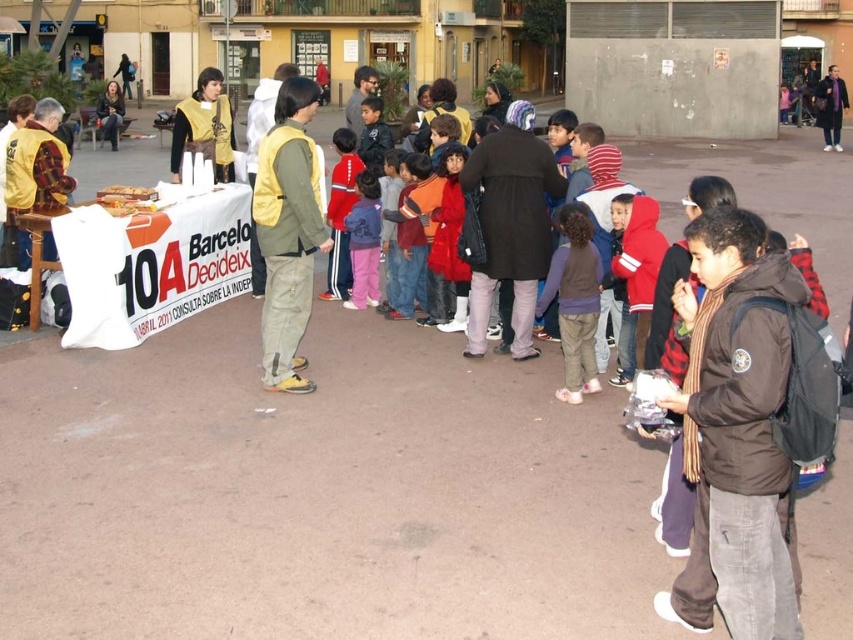
You are a photographer standing in the plaza and want to take a photo of the purple scarf at center. Based on its position coordinates, where should you aim your camera?

The purple scarf at center is located at coordinates point (x=830, y=108), so aim your camera slightly to the left and lower down from the center of the image to capture it.

You are a photographer at the event and want to capture a photo of the purple scarf at center and the matte yellow vest at center. Which object should you focus on first to ensure both are in the frame?

The purple scarf at center is in front of the matte yellow vest at center, so you should focus on the purple scarf at center first to ensure both are in the frame.